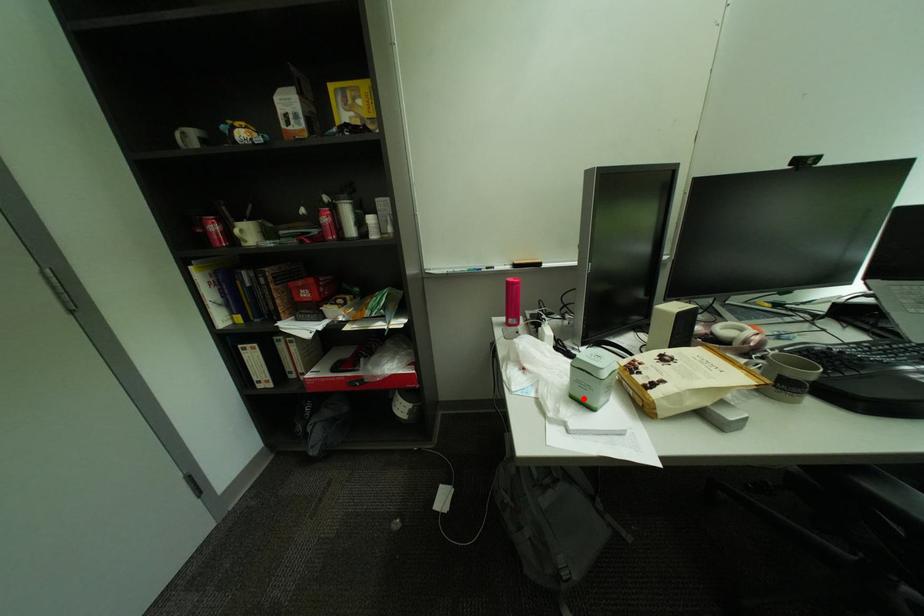
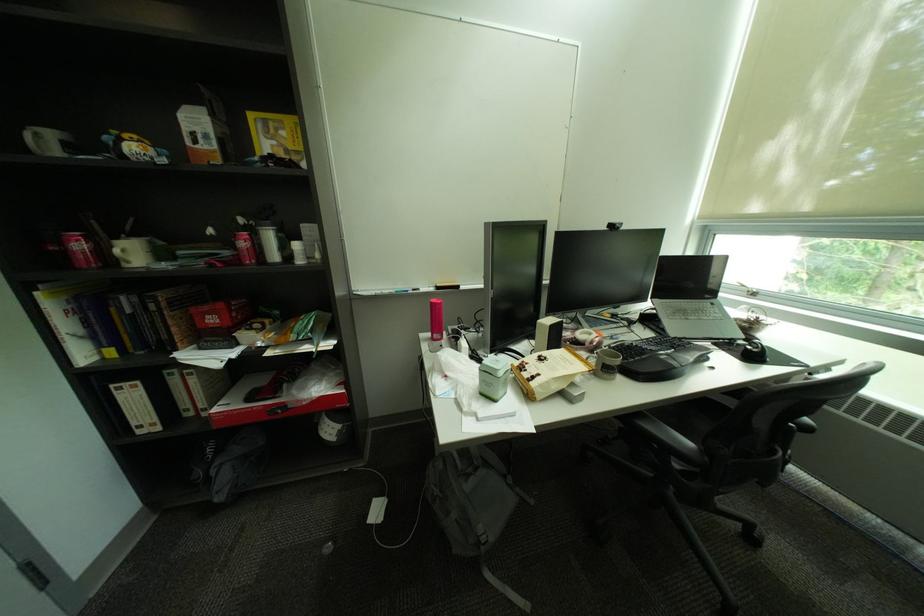
Locate, in the second image, the point that corresponds to the highlighted location in the first image.

(492, 395)